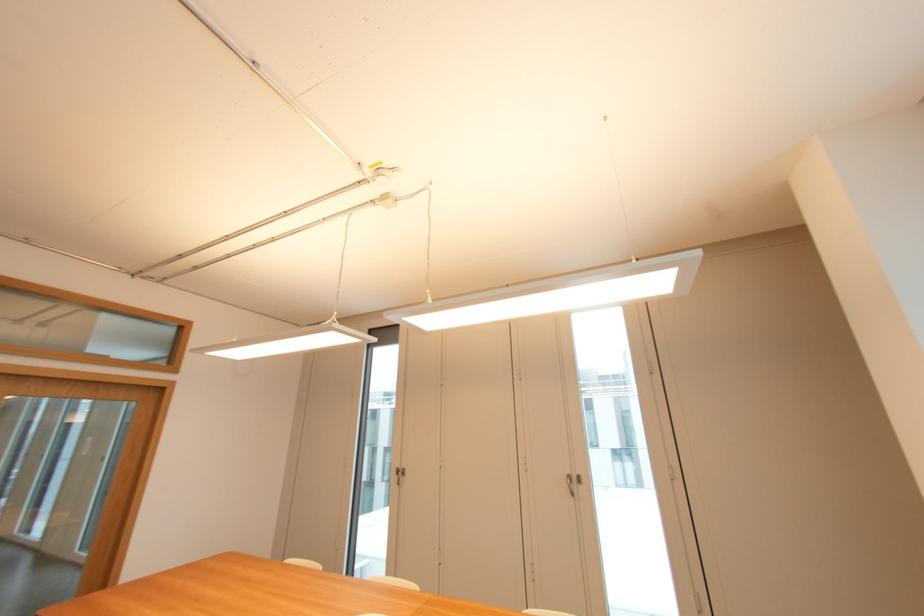
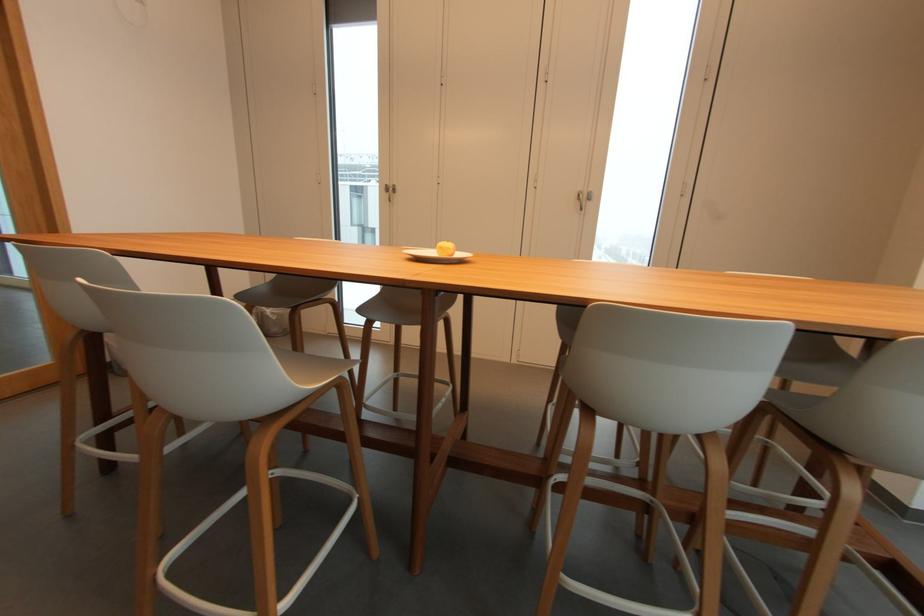
Question: The images are taken continuously from a first-person perspective. In which direction is your viewpoint rotating?

Choices:
 (A) Left
 (B) Right
 (C) Up
 (D) Down

Answer: (D)